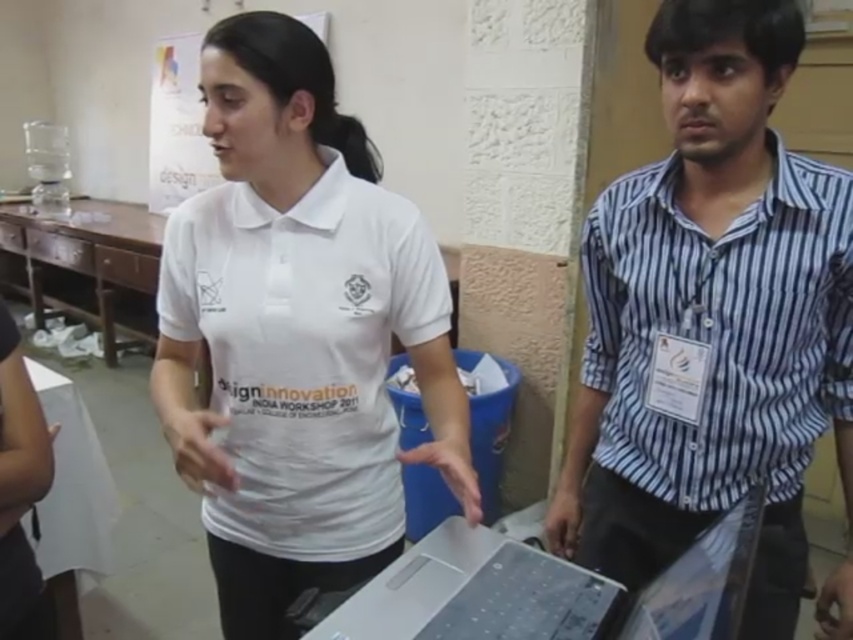
You are an event photographer at the Design Innovation India Workshop 2011. You need to capture a clear photo of the silver metallic laptop at center without the blue striped shirt at right blocking it. What adjustment should you make to your camera angle?

To avoid the blue striped shirt at right blocking the silver metallic laptop at center, you should lower your camera angle since the blue striped shirt at right is positioned over the laptop, making it visible from above. By adjusting the angle downward, the shirt will no longer obscure the laptop.

You are an event photographer in this workshop. You need to take a closeup photo of the white matte shirt at center and the silver metallic laptop at center. Which object should you zoom in on first to ensure both are in focus?

The white matte shirt at center is larger in size than the silver metallic laptop at center, so you should zoom in on the smaller object, the silver metallic laptop at center first to ensure both are in focus.